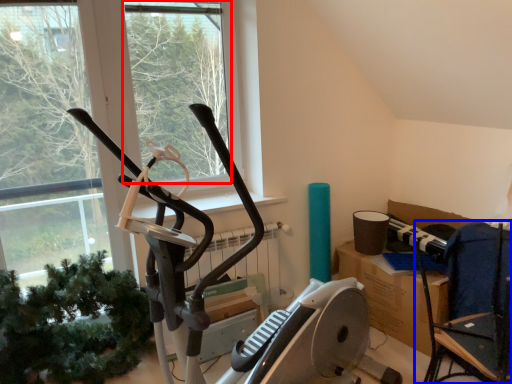
Question: Which point is closer to the camera, window screen (highlighted by a red box) or chair (highlighted by a blue box)?

Choices:
 (A) window screen
 (B) chair

Answer: (B)